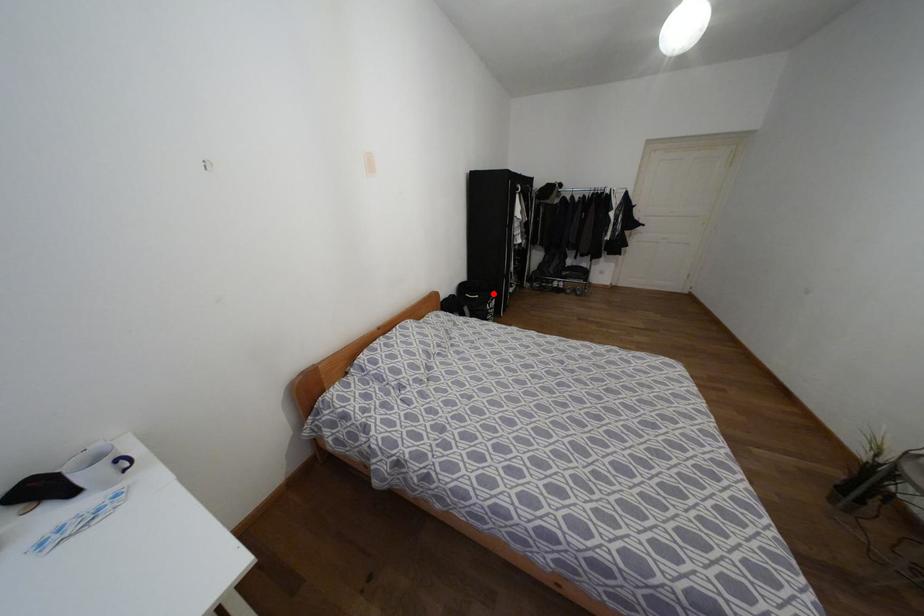
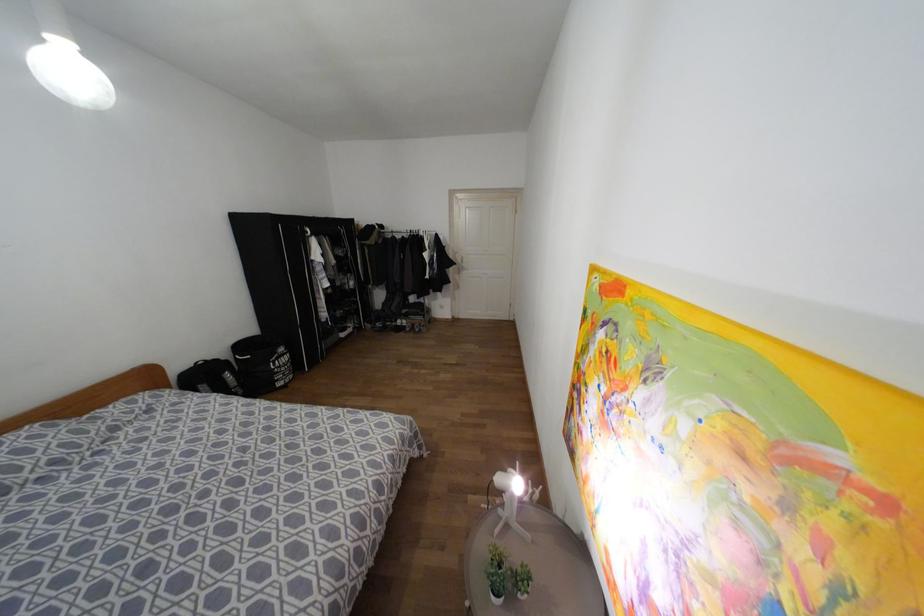
Question: I am providing you with two images of the same scene from different viewpoints. A red point is shown in image1. For the corresponding object point in image2, is it positioned nearer or farther from the camera?

Choices:
 (A) Nearer
 (B) Farther

Answer: (A)